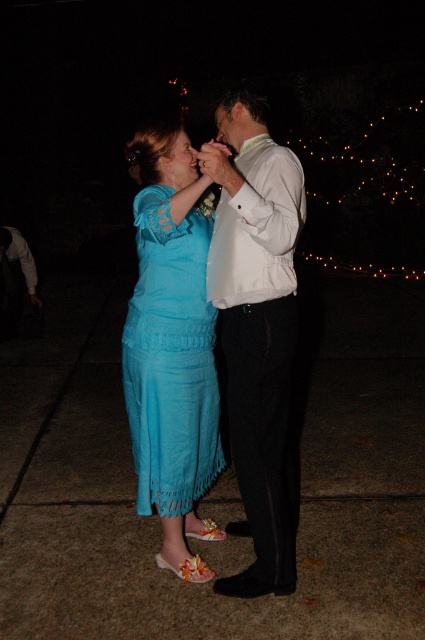
Is white satin shirt at center thinner than white satin dress shirt at center?

Incorrect, white satin shirt at center's width is not less than white satin dress shirt at center's.

The height and width of the screenshot is (640, 425). Describe the element at coordinates (257, 332) in the screenshot. I see `white satin shirt at center` at that location.

This screenshot has width=425, height=640. What are the coordinates of `white satin shirt at center` in the screenshot? It's located at (257, 332).

Is turquoise fabric dress at center further to the viewer compared to white satin dress shirt at center?

That is True.

The width and height of the screenshot is (425, 640). I want to click on turquoise fabric dress at center, so click(x=170, y=358).

Is point (166, 497) positioned behind point (257, 268)?

That is True.

Find the location of a particular element. turquoise fabric dress at center is located at coordinates (170, 358).

Is white satin shirt at center to the right of turquoise fabric dress at center from the viewer's perspective?

Indeed, white satin shirt at center is positioned on the right side of turquoise fabric dress at center.

Can you confirm if white satin shirt at center is taller than turquoise fabric dress at center?

Yes.

Who is more forward, (238, 417) or (172, 368)?

Positioned in front is point (238, 417).

I want to click on white satin shirt at center, so click(257, 332).